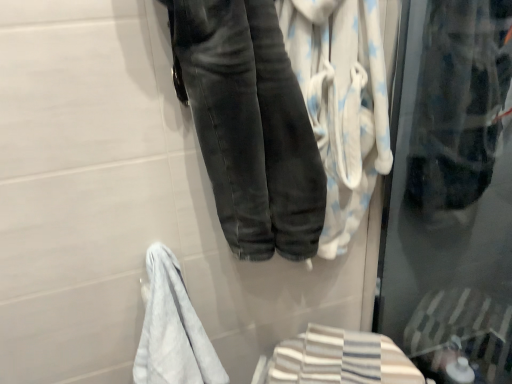
Question: From the image's perspective, is white soft towel at center, positioned as the 2th bath towel in bottom-to-top order, over dark gray denim jeans at center?

Choices:
 (A) no
 (B) yes

Answer: (A)

Question: Is white soft towel at center, positioned as the 2th bath towel in bottom-to-top order, bigger than dark gray denim jeans at center?

Choices:
 (A) yes
 (B) no

Answer: (B)

Question: Is white soft towel at center, the 1th bath towel viewed from the top, at the left side of dark gray denim jeans at center?

Choices:
 (A) yes
 (B) no

Answer: (B)

Question: Is white soft towel at center, positioned as the 2th bath towel in bottom-to-top order, positioned behind dark gray denim jeans at center?

Choices:
 (A) yes
 (B) no

Answer: (A)

Question: Is the depth of white soft towel at center, positioned as the 2th bath towel in bottom-to-top order, less than that of dark gray denim jeans at center?

Choices:
 (A) no
 (B) yes

Answer: (A)

Question: From a real-world perspective, relative to white soft towel at center, the 1th bath towel viewed from the top, is white soft towel at lower left vertically above or below?

Choices:
 (A) below
 (B) above

Answer: (A)

Question: Does point (226, 377) appear closer or farther from the camera than point (352, 215)?

Choices:
 (A) farther
 (B) closer

Answer: (A)

Question: Is white soft towel at lower left taller or shorter than white soft towel at center, positioned as the 2th bath towel in bottom-to-top order?

Choices:
 (A) short
 (B) tall

Answer: (A)

Question: From the image's perspective, is white soft towel at lower left above or below white soft towel at center, positioned as the 2th bath towel in bottom-to-top order?

Choices:
 (A) above
 (B) below

Answer: (B)

Question: Is dark gray denim jeans at center in front of or behind white soft towel at lower left in the image?

Choices:
 (A) front
 (B) behind

Answer: (A)

Question: Considering the relative positions of dark gray denim jeans at center and white soft towel at lower left in the image provided, is dark gray denim jeans at center to the left or to the right of white soft towel at lower left?

Choices:
 (A) right
 (B) left

Answer: (A)

Question: From the image's perspective, is dark gray denim jeans at center located above or below white soft towel at lower left?

Choices:
 (A) below
 (B) above

Answer: (B)

Question: From a real-world perspective, is dark gray denim jeans at center physically located above or below white soft towel at lower left?

Choices:
 (A) below
 (B) above

Answer: (B)

Question: Relative to striped cotton bath towel at lower right, which ranks as the 2th bath towel in top-to-bottom order, is dark gray denim jeans at center in front or behind?

Choices:
 (A) front
 (B) behind

Answer: (A)

Question: From their relative heights in the image, would you say dark gray denim jeans at center is taller or shorter than striped cotton bath towel at lower right, which ranks as the 2th bath towel in top-to-bottom order?

Choices:
 (A) short
 (B) tall

Answer: (B)